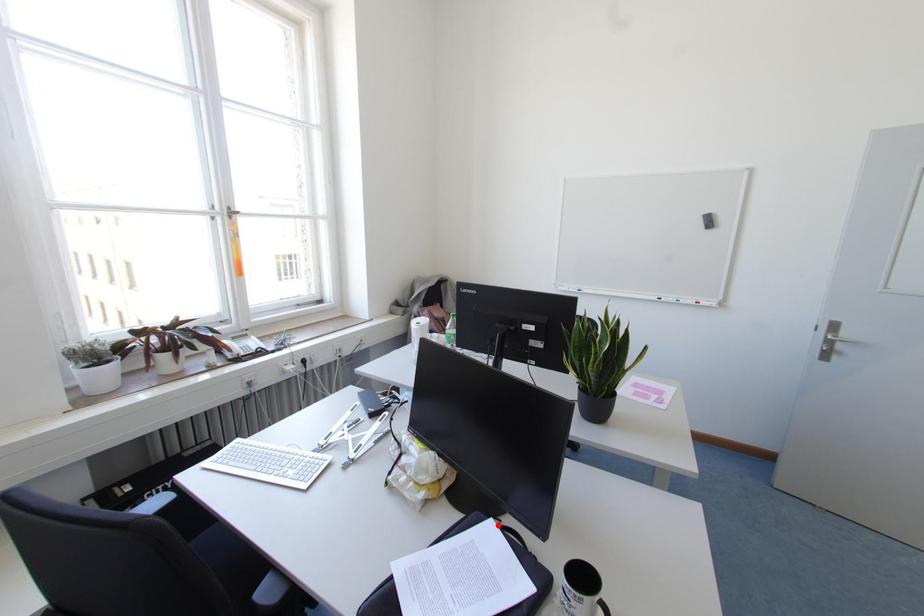
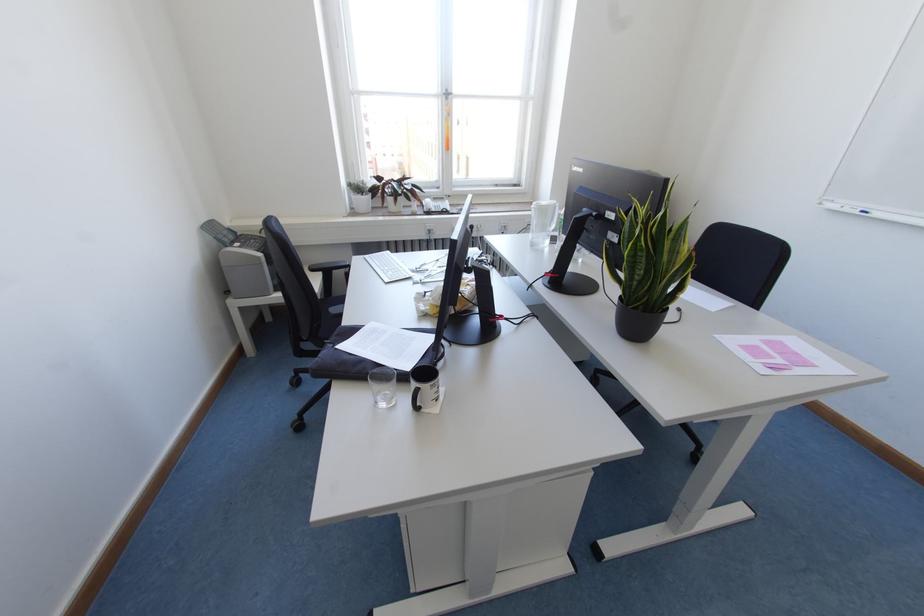
Where in the second image is the point corresponding to the highlighted location from the first image?

(433, 338)